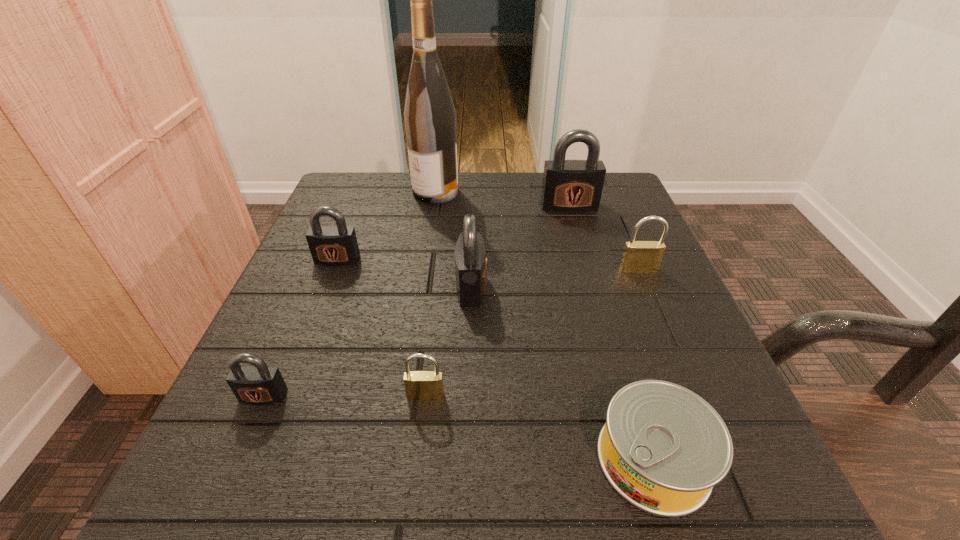
Locate an element on the screen. The height and width of the screenshot is (540, 960). the smaller brass padlock is located at coordinates (419, 385).

Find the location of a particular element. The width and height of the screenshot is (960, 540). can is located at coordinates (663, 448).

Where is `the nearest object`? the nearest object is located at coordinates (663, 448).

Locate an element on the screen. The width and height of the screenshot is (960, 540). vacant space located 0.220m on the right of the wine bottle is located at coordinates (550, 192).

I want to click on vacant space located on the front of the fifth padlock from left to right near the keyhole, so click(x=589, y=278).

Where is `vacant space located on the front of the fifth object from left to right near the keyhole`? The image size is (960, 540). vacant space located on the front of the fifth object from left to right near the keyhole is located at coordinates (608, 287).

Identify the location of blank space located on the front of the second farthest gray padlock near the keyhole. (307, 338).

Where is `vacant region located on the front-facing side of the farther brass padlock`? This screenshot has width=960, height=540. vacant region located on the front-facing side of the farther brass padlock is located at coordinates (686, 383).

This screenshot has height=540, width=960. I want to click on free spot located 0.060m on the front of the smallest gray padlock near the keyhole, so click(241, 447).

Where is `blank space located on the front-facing side of the third padlock from left to right`? Image resolution: width=960 pixels, height=540 pixels. blank space located on the front-facing side of the third padlock from left to right is located at coordinates (419, 454).